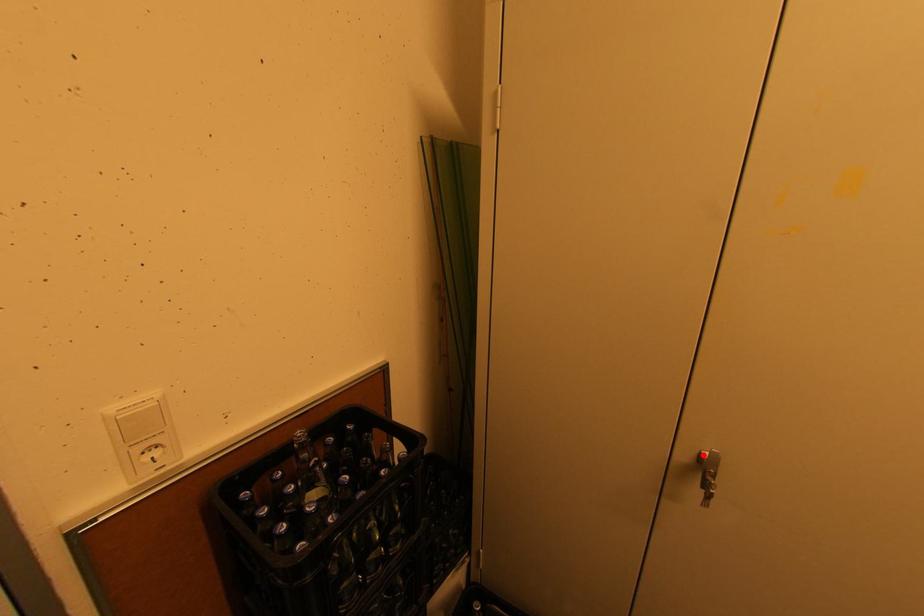
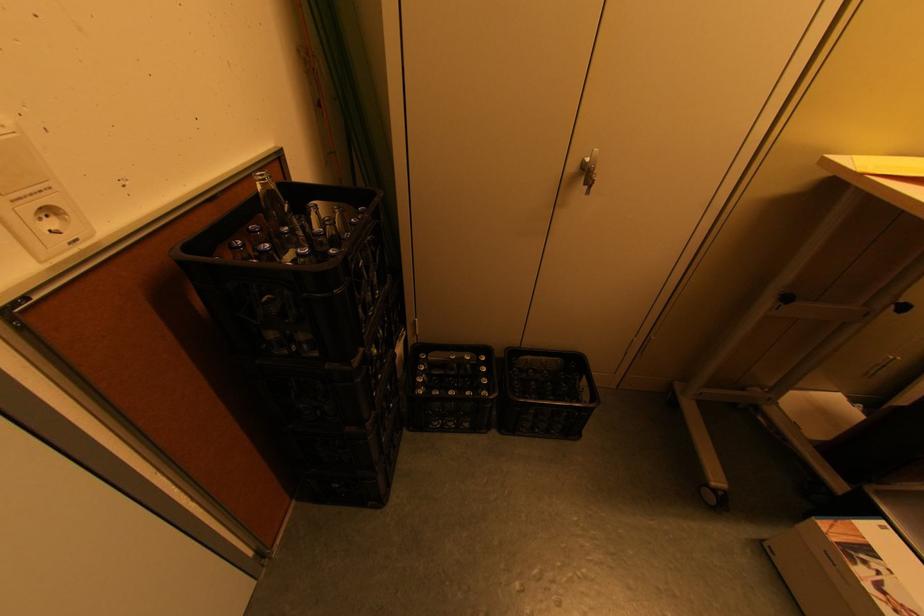
Locate, in the second image, the point that corresponds to the highlighted location in the first image.

(587, 161)